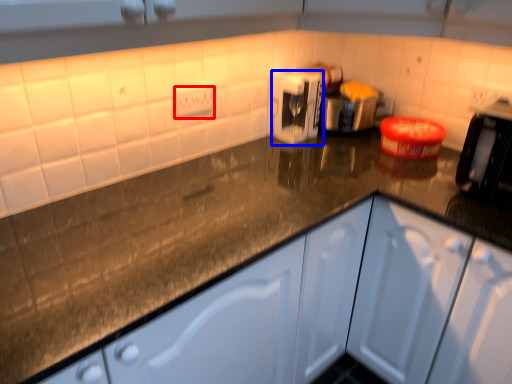
Question: Which of the following is the farthest to the observer, electric outlet (highlighted by a red box) or appliance (highlighted by a blue box)?

Choices:
 (A) electric outlet
 (B) appliance

Answer: (B)